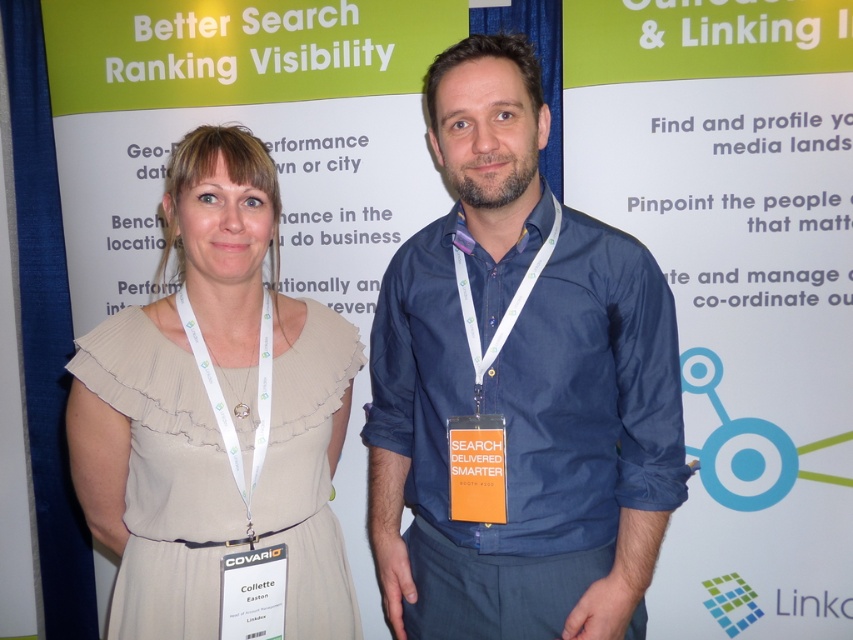
Question: Among these points, which one is farthest from the camera?

Choices:
 (A) (614, 547)
 (B) (213, 196)

Answer: (A)

Question: Can you confirm if blue denim shirt at center is positioned below beige chiffon dress at center?

Choices:
 (A) no
 (B) yes

Answer: (A)

Question: Does blue denim shirt at center have a greater width compared to beige chiffon dress at center?

Choices:
 (A) no
 (B) yes

Answer: (B)

Question: Can you confirm if blue denim shirt at center is positioned to the right of beige chiffon dress at center?

Choices:
 (A) yes
 (B) no

Answer: (A)